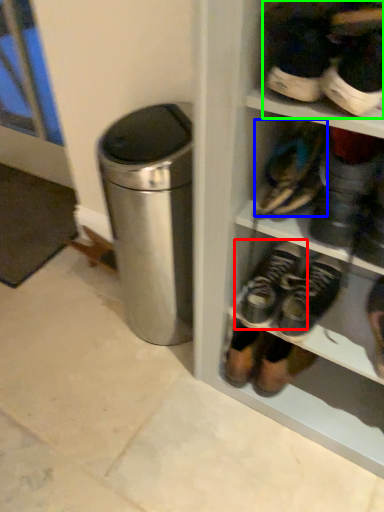
Question: Which is nearer to the footwear (highlighted by a red box)? footwear (highlighted by a blue box) or footwear (highlighted by a green box).

Choices:
 (A) footwear
 (B) footwear

Answer: (A)